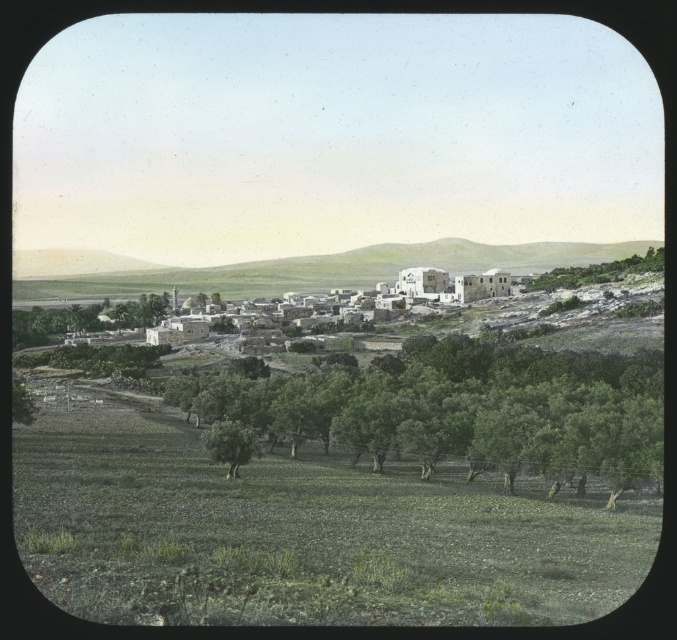
You are standing in the rural landscape and want to take a photo of both the green leafy olive tree at center and the white stone window at center. Which object should you frame first in your camera viewfinder to ensure both are in the shot?

The green leafy olive tree at center is positioned on the left side of the white stone window at center. To ensure both are in the shot, frame the green leafy olive tree at center first and then adjust the viewfinder to include the white stone window at center on its right side.

You are standing at the point marked by coordinates point (458, 410) in the image. Looking around, what is the most prominent object directly in front of you?

The most prominent object directly in front of you is the green leafy tree at center, as the coordinates point (458, 410) indicate its location.

Based on the photo, you are standing at the edge of the field in the rural landscape and want to reach the white stucco buildings at center. According to the coordinates provided, in which general direction should you head to reach them?

The white stucco buildings at center are located at coordinates point (290, 268), which means they are positioned slightly to the right and forward from your current position at the edge of the field. You should head in a diagonal direction towards the center of the scene to reach them.